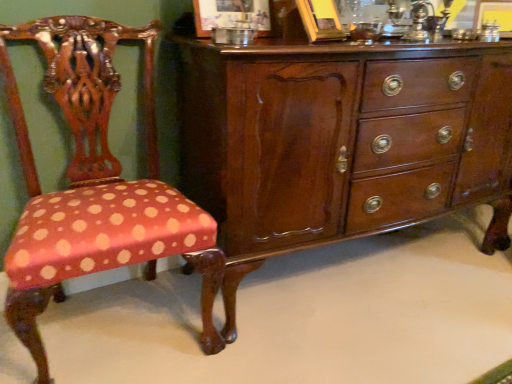
At what (x,y) coordinates should I click in order to perform the action: click on vacant area situated below polka dot fabric chair at left (from a real-world perspective). Please return your answer as a coordinate pair (x, y). Looking at the image, I should click on (114, 327).